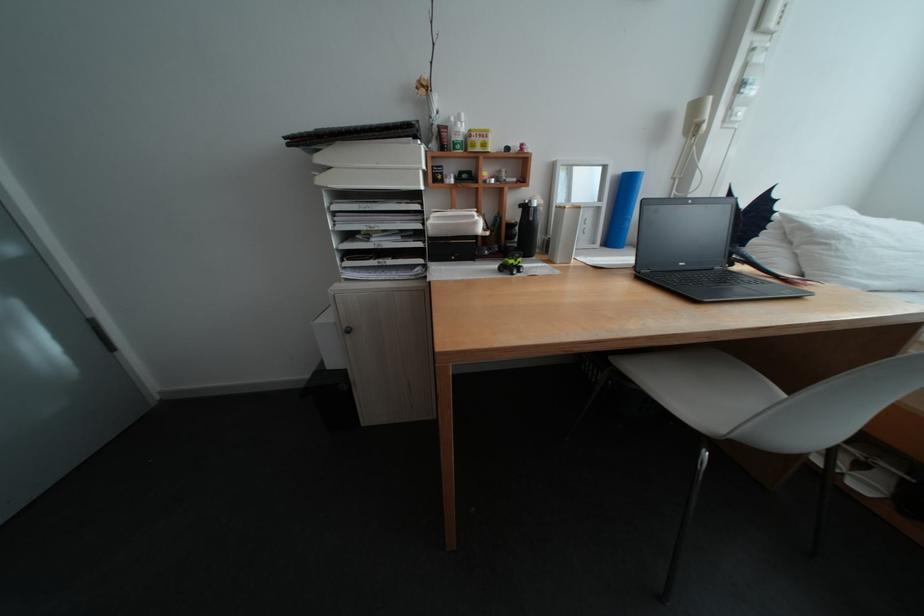
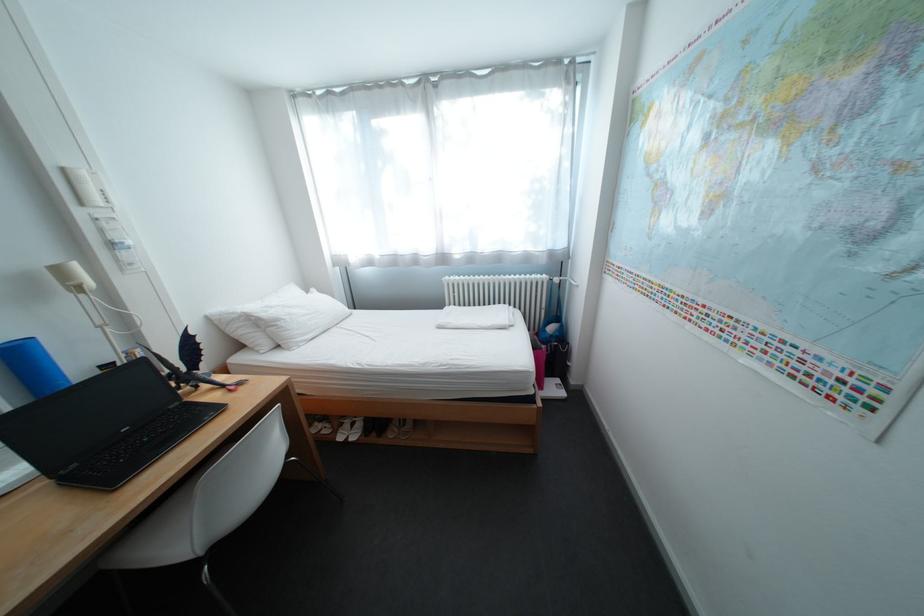
In the second image, find the point that corresponds to the point at 694,265 in the first image.

(137, 431)